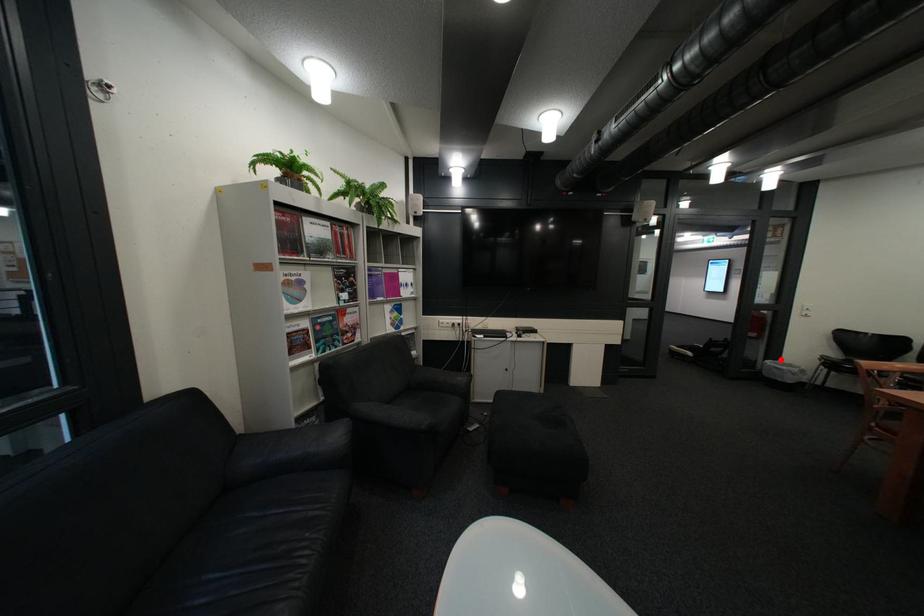
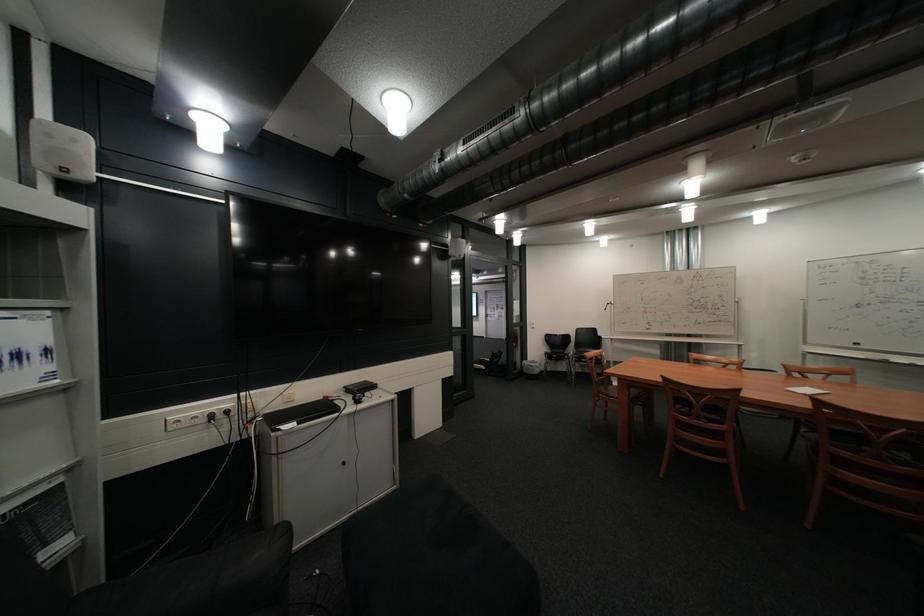
Question: I am providing you with two images of the same scene from different viewpoints. A red point is shown in image1. For the corresponding object point in image2, is it positioned nearer or farther from the camera?

Choices:
 (A) Nearer
 (B) Farther

Answer: (B)